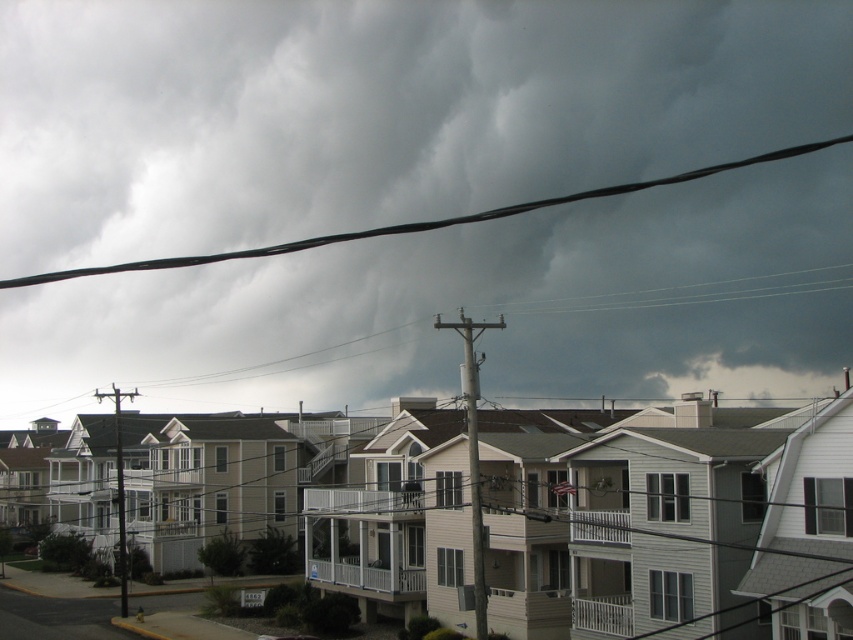
Locate an element on the screen. black wire at upper center is located at coordinates (418, 221).

Is black wire at upper center to the left of gray metallic pole at center from the viewer's perspective?

Correct, you'll find black wire at upper center to the left of gray metallic pole at center.

What do you see at coordinates (418, 221) in the screenshot? I see `black wire at upper center` at bounding box center [418, 221].

Identify the location of black wire at upper center. (418, 221).

Which of these two, dark gray cloud at upper center or black wire at upper center, stands shorter?

With less height is black wire at upper center.

Does point (621, 323) come closer to viewer compared to point (32, 284)?

Yes, it is.

The height and width of the screenshot is (640, 853). What are the coordinates of `dark gray cloud at upper center` in the screenshot? It's located at (376, 112).

Can you confirm if dark gray cloud at upper center is positioned to the left of gray metallic pole at center?

Yes, dark gray cloud at upper center is to the left of gray metallic pole at center.

Between dark gray cloud at upper center and gray metallic pole at center, which one appears on the left side from the viewer's perspective?

dark gray cloud at upper center is more to the left.

What do you see at coordinates (376, 112) in the screenshot?
I see `dark gray cloud at upper center` at bounding box center [376, 112].

Identify the location of dark gray cloud at upper center. (376, 112).